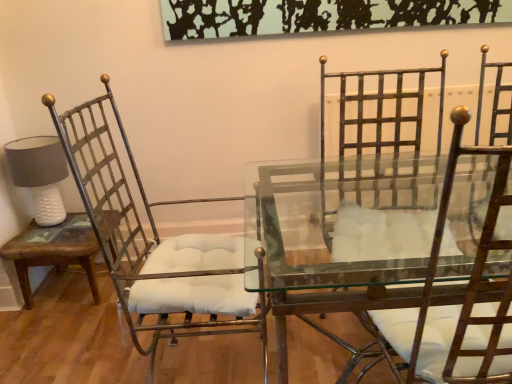
The height and width of the screenshot is (384, 512). I want to click on vacant space situated above brown wood side table at left (from a real-world perspective), so click(55, 236).